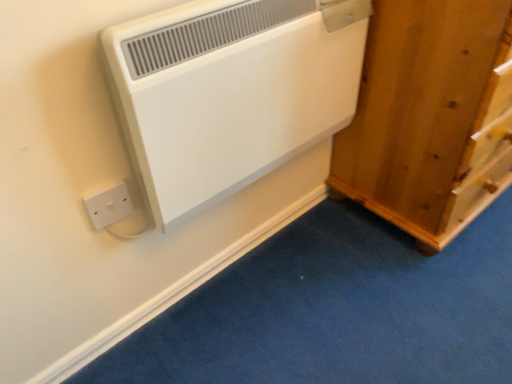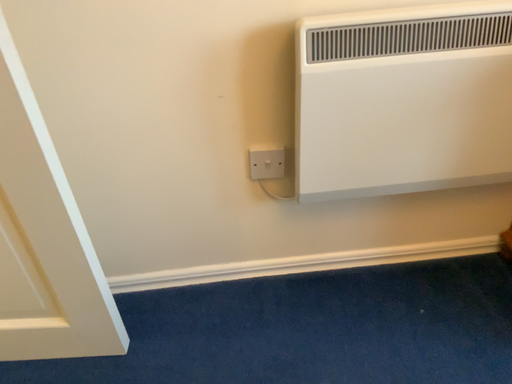
Question: Which way did the camera rotate in the video?

Choices:
 (A) rotated left
 (B) rotated right

Answer: (A)